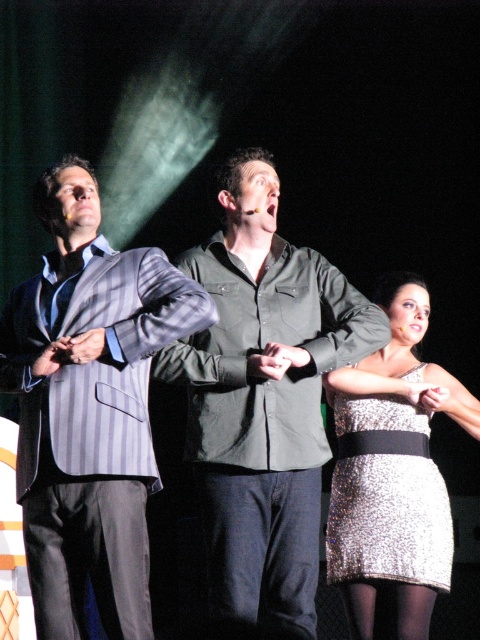
Based on the coordinates provided, which object is located at point (88,406) in the image?

The point (88,406) corresponds to the gray striped suit at left.